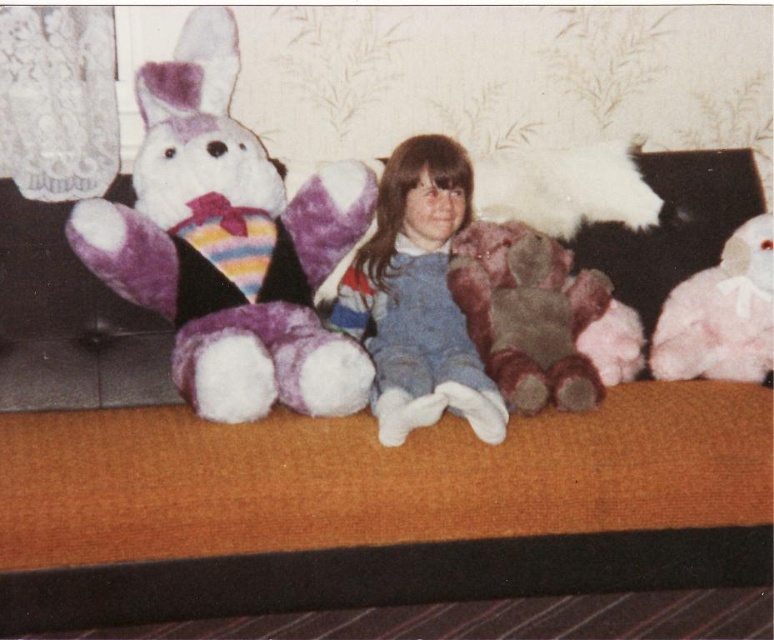
You are a photographer standing in front of the couch where the girl is sitting. You want to take a closeup shot of the purple plush bunny at left without moving the girl. Can you get within 5 feet of the couch to do so?

The purple plush bunny at left is 5.65 feet away from the viewer, so yes, you can get within 5 feet of the couch to take the closeup shot since the distance is slightly more than 5 feet.

The young girl is sitting on the couch with two plush toys. The purple plush bunny at left and the fuzzy brown teddy bear at center. Which toy is bigger?

The purple plush bunny at left is larger than the fuzzy brown teddy bear at center.